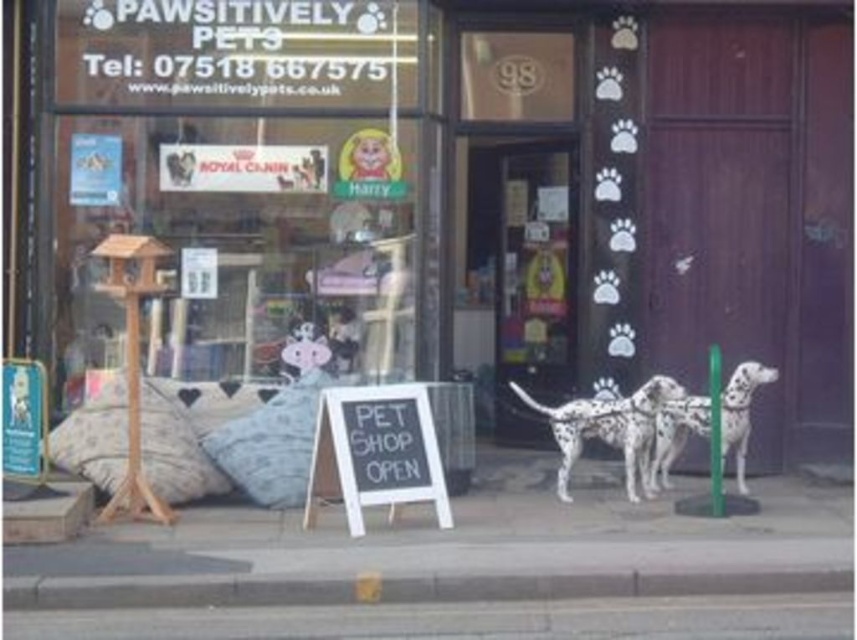
Question: Which object is the closest to the black chalkboard sign at center?

Choices:
 (A) white spotted fur at right
 (B) white spotted fur dog at center
 (C) fluffy fabric pillow at lower left

Answer: (C)

Question: Among these objects, which one is farthest from the camera?

Choices:
 (A) matte glass shop window at center
 (B) white spotted fur dog at center
 (C) fluffy fabric pillow at center

Answer: (A)

Question: Can you confirm if black chalkboard sign at center is positioned to the right of fluffy fabric pillow at center?

Choices:
 (A) no
 (B) yes

Answer: (B)

Question: Does fluffy fabric pillow at center have a larger size compared to white spotted fur dog at center?

Choices:
 (A) yes
 (B) no

Answer: (B)

Question: Estimate the real-world distances between objects in this image. Which object is closer to the white spotted fur dog at center?

Choices:
 (A) fluffy fabric pillow at lower left
 (B) fluffy fabric pillow at center
 (C) matte glass shop window at center
 (D) black chalkboard sign at center

Answer: (D)

Question: Is black chalkboard sign at center to the left of fluffy fabric pillow at lower left from the viewer's perspective?

Choices:
 (A) no
 (B) yes

Answer: (A)